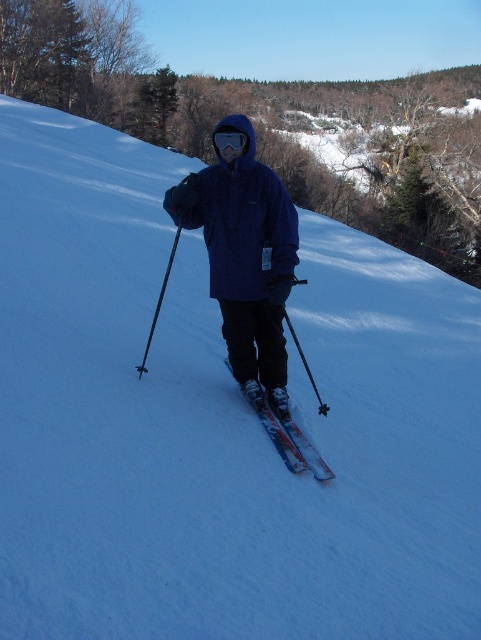
Question: Does matte blue jacket at center have a larger size compared to shiny metallic skis at center?

Choices:
 (A) no
 (B) yes

Answer: (B)

Question: Can you confirm if matte blue jacket at center is positioned above shiny metallic skis at center?

Choices:
 (A) no
 (B) yes

Answer: (B)

Question: Does matte blue jacket at center have a smaller size compared to shiny metallic skis at center?

Choices:
 (A) no
 (B) yes

Answer: (A)

Question: Among these objects, which one is farthest from the camera?

Choices:
 (A) matte blue jacket at center
 (B) shiny metallic skis at center

Answer: (A)

Question: Which object is closer to the camera taking this photo?

Choices:
 (A) shiny metallic skis at center
 (B) matte blue jacket at center

Answer: (A)